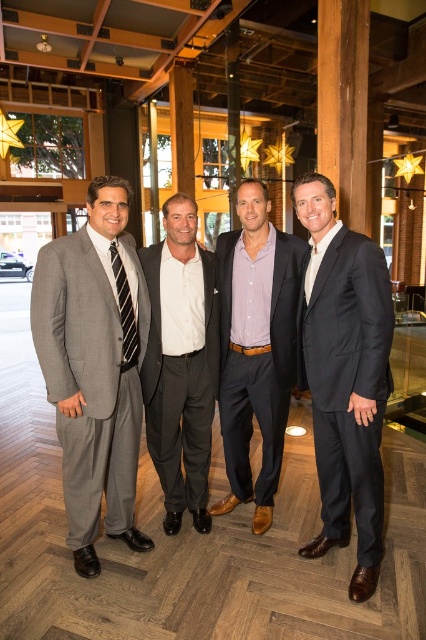
Is purple cotton shirt at center shorter than striped fabric tie at left?

Incorrect, purple cotton shirt at center's height does not fall short of striped fabric tie at left's.

Between purple cotton shirt at center and striped fabric tie at left, which one is positioned higher?

striped fabric tie at left is above.

Describe the element at coordinates (256, 348) in the screenshot. I see `purple cotton shirt at center` at that location.

This screenshot has height=640, width=426. In order to click on purple cotton shirt at center in this screenshot , I will do `click(256, 348)`.

Who is more forward, [123,326] or [321,259]?

Positioned in front is point [321,259].

In the scene shown: How far apart are striped fabric tie at left and black silk tie at right?

32.25 inches

Between point (134, 339) and point (316, 269), which one is positioned in front?

Point (316, 269) is more forward.

The image size is (426, 640). Find the location of `striped fabric tie at left`. striped fabric tie at left is located at coordinates (124, 310).

Is gray wool suit at left wider than purple cotton shirt at center?

Incorrect, gray wool suit at left's width does not surpass purple cotton shirt at center's.

Who is lower down, gray wool suit at left or purple cotton shirt at center?

gray wool suit at left is below.

Does point (89, 444) come farther from viewer compared to point (224, 340)?

No, it is in front of (224, 340).

Find the location of a particular element. The image size is (426, 640). gray wool suit at left is located at coordinates (94, 365).